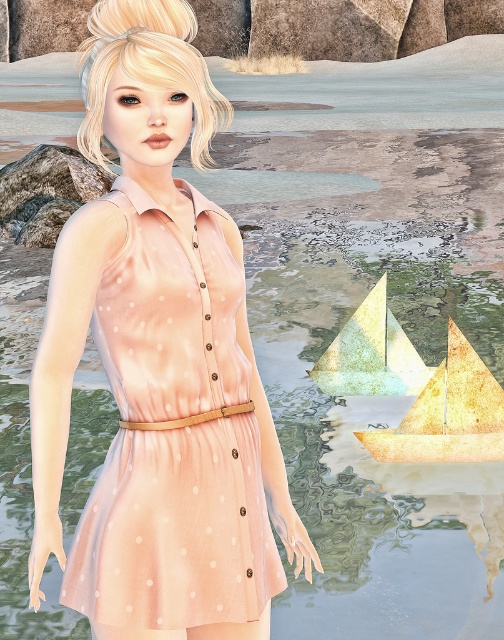
Question: Does peach satin dress at center appear under gold textured sailboat at lower right?

Choices:
 (A) no
 (B) yes

Answer: (A)

Question: Is peach satin dress at center further to the viewer compared to gold textured sailboat at lower right?

Choices:
 (A) no
 (B) yes

Answer: (A)

Question: Which of the following is the farthest from the observer?

Choices:
 (A) (207, 394)
 (B) (411, 429)

Answer: (B)

Question: Which point is closer to the camera?

Choices:
 (A) peach satin dress at center
 (B) gold textured sailboat at lower right

Answer: (A)

Question: Can you confirm if peach satin dress at center is positioned above gold textured sailboat at lower right?

Choices:
 (A) yes
 (B) no

Answer: (A)